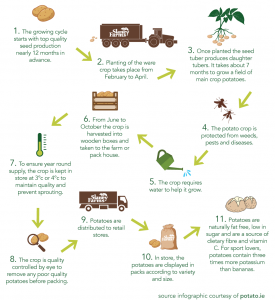
At what (x,y) coordinates should I click in order to perform the action: click on thermometer. Please return your answer as a coordinate pair (x, y). This screenshot has width=275, height=300. Looking at the image, I should click on (39, 149).